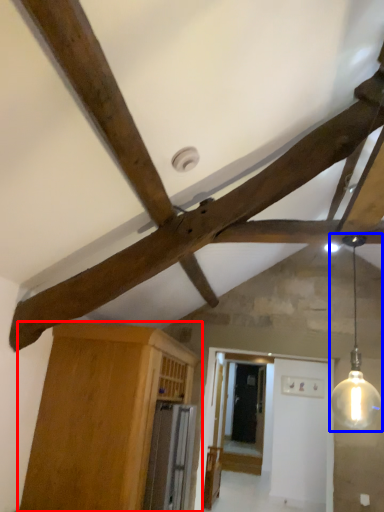
Question: Among these objects, which one is nearest to the camera, cabinetry (highlighted by a red box) or light fixture (highlighted by a blue box)?

Choices:
 (A) cabinetry
 (B) light fixture

Answer: (B)